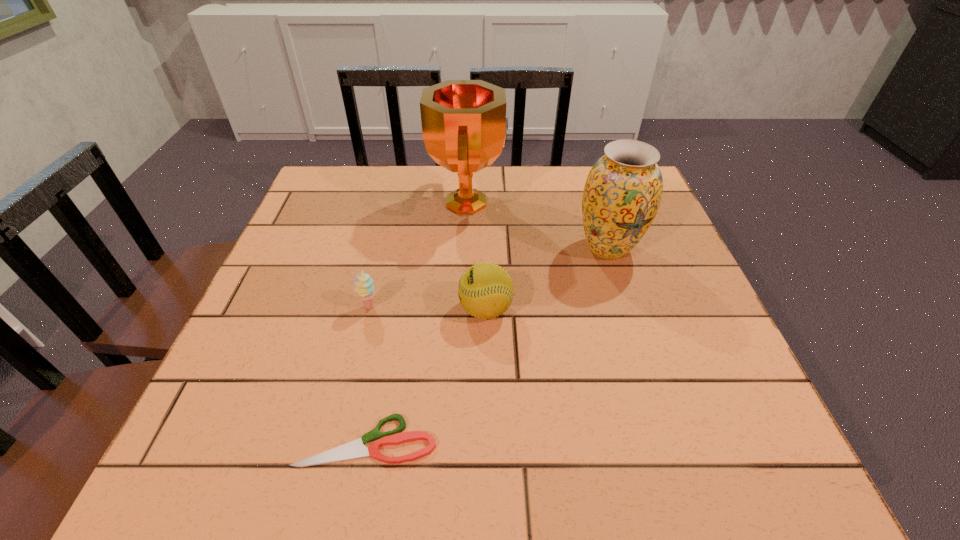
At what (x,y) coordinates should I click in order to perform the action: click on award. Please return your answer as a coordinate pair (x, y). The width and height of the screenshot is (960, 540). Looking at the image, I should click on (464, 125).

Locate an element on the screen. vase is located at coordinates (623, 191).

You are a GUI agent. You are given a task and a screenshot of the screen. Output one action in this format:
    pyautogui.click(x=<x>, y=<y>)
    Task: Click on the fourth shortest object
    Image resolution: width=960 pixels, height=540 pixels.
    Given the screenshot: What is the action you would take?
    pyautogui.click(x=623, y=191)

This screenshot has height=540, width=960. What are the coordinates of `softball` in the screenshot? It's located at click(x=485, y=290).

Identify the location of sherbert. The height and width of the screenshot is (540, 960). (363, 286).

In order to click on the shortest object in this screenshot , I will do `click(356, 449)`.

Where is `scissors`? scissors is located at coordinates (356, 449).

This screenshot has width=960, height=540. I want to click on free space located on the side of the award with the star emblem, so click(621, 203).

At what (x,y) coordinates should I click in order to perform the action: click on vacant region located 0.210m on the left of the vase. Please return your answer as a coordinate pair (x, y). Looking at the image, I should click on (486, 248).

Locate an element on the screen. This screenshot has width=960, height=540. free space located 0.050m on the logo side of the softball is located at coordinates (435, 309).